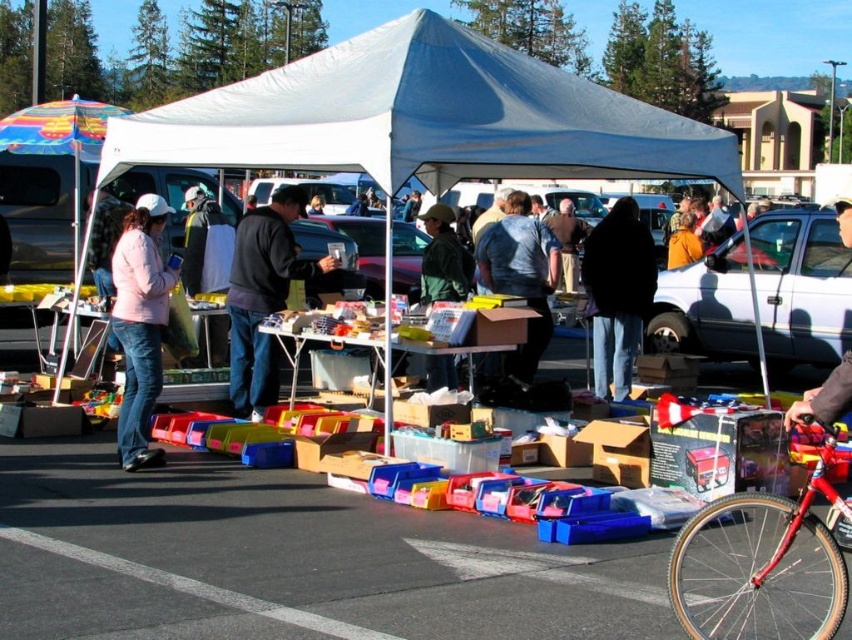
You are a vendor at the flea market and need to hang a banner that is 3 meters wide. You want to place it under the white fabric tent at center and the matte gray shirt at center. Which object can the banner fit under without folding?

The banner that is 3 meters wide can fit under the white fabric tent at center because it is wider than the matte gray shirt at center.

You are a vendor at the flea market and need to determine if your matte gray shirt at center can fit under the white fabric canopy at upper center. Based on their sizes, will it fit?

The white fabric canopy at upper center is wider than the matte gray shirt at center, so the shirt will fit comfortably under the canopy.

You are standing at the entrance of the flea market and see the green fabric jacket at center. If you want to reach it quickly, should you walk straight ahead or turn left?

The green fabric jacket at center is only 29.57 feet away from you, so you should walk straight ahead to reach it quickly.